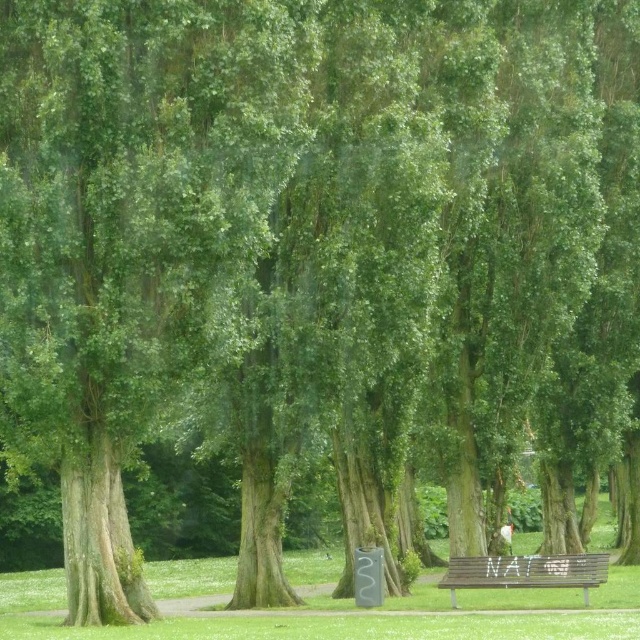
Question: Which of the following is the farthest from the observer?

Choices:
 (A) (637, 598)
 (B) (586, 598)

Answer: (A)

Question: Which object appears farthest from the camera in this image?

Choices:
 (A) wooden bench at lower center
 (B) green grass at lower center

Answer: (A)

Question: Is green grass at lower center above wooden bench at lower center?

Choices:
 (A) yes
 (B) no

Answer: (B)

Question: Which of the following is the farthest from the observer?

Choices:
 (A) tap(257, 636)
 (B) tap(568, 572)

Answer: (B)

Question: Is green grass at lower center wider than wooden bench at lower center?

Choices:
 (A) no
 (B) yes

Answer: (B)

Question: Does green grass at lower center appear over wooden bench at lower center?

Choices:
 (A) yes
 (B) no

Answer: (B)